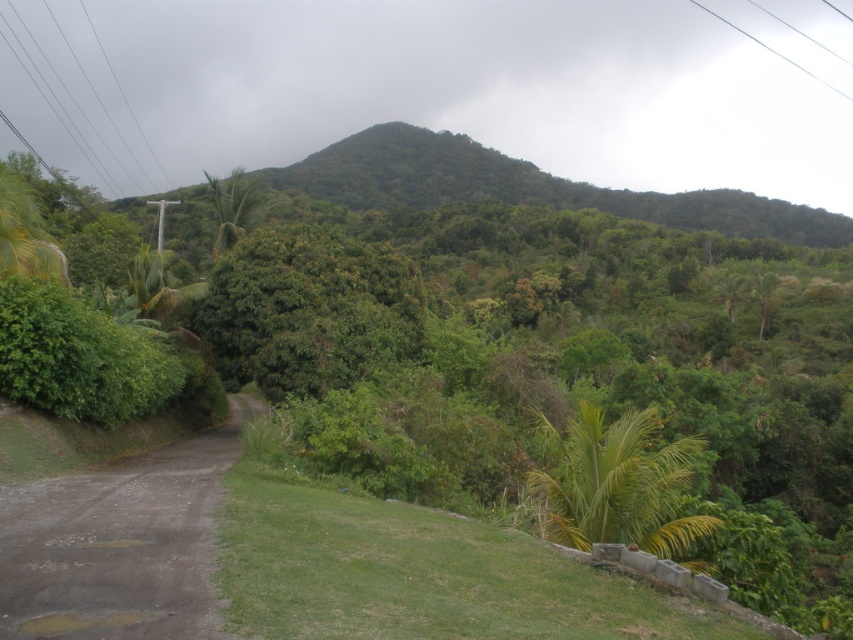
Question: Based on their relative distances, which object is nearer to the metallic wire at upper left?

Choices:
 (A) green leafy tree at center
 (B) white plastic power line at upper right
 (C) green leafy palm at center

Answer: (B)

Question: Which object is farther from the camera taking this photo?

Choices:
 (A) white plastic power line at upper right
 (B) green leafy palm at center

Answer: (A)

Question: Can you confirm if green leafy palm at left is positioned below white plastic power line at upper right?

Choices:
 (A) yes
 (B) no

Answer: (A)

Question: Does metallic wire at upper left lie behind green leafy palm at left?

Choices:
 (A) yes
 (B) no

Answer: (A)

Question: Among these objects, which one is farthest from the camera?

Choices:
 (A) green leafy palm at center
 (B) green leafy mountain at center

Answer: (B)

Question: Can you confirm if green leafy mountain at center is wider than metallic wire at upper left?

Choices:
 (A) yes
 (B) no

Answer: (A)